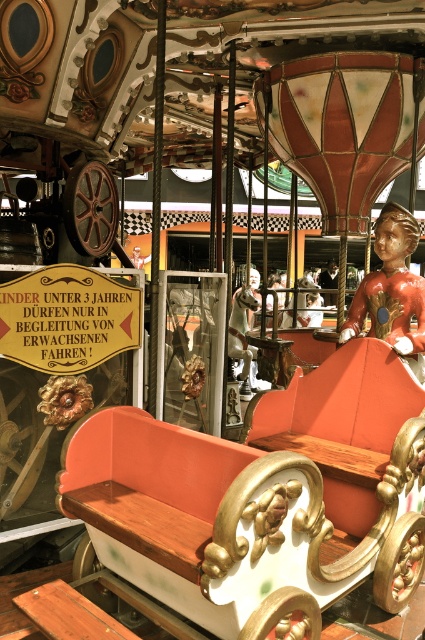
You are standing at the entrance of the carousel and want to sit down. There is a wooden bench at center marked by point (258, 499). Can you walk directly to the bench from your current position?

Yes, you can walk directly to the wooden bench at center marked by point (258, 499) because there are no obstacles mentioned in the scene description between your position and the bench.

You are standing at the entrance of the carousel and want to sit down. Where is the wooden bench at center located?

The wooden bench at center is located at point (x=258, y=499).